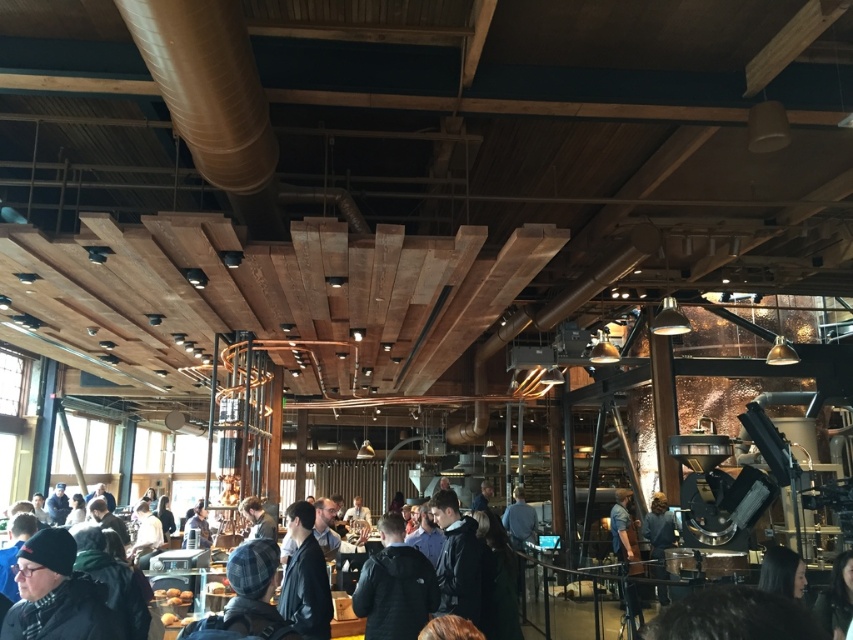
You are a customer in the coffee shop and want to order a drink. You see two people in front of you at the counter. One has smooth black hair at lower right and the other is wearing a blue shirt at center. Which person is shorter?

The smooth black hair at lower right is not as tall as the blue shirt at center, so the person with smooth black hair at lower right is shorter.

You are a barista working behind the counter in the modern industrial coffee shop. You notice a customer wearing a dark blue jacket at center and another customer with smooth black hair at lower right. Which of these two customers is taller?

The dark blue jacket at center is taller than the smooth black hair at lower right, so the customer wearing the dark blue jacket at center is taller.